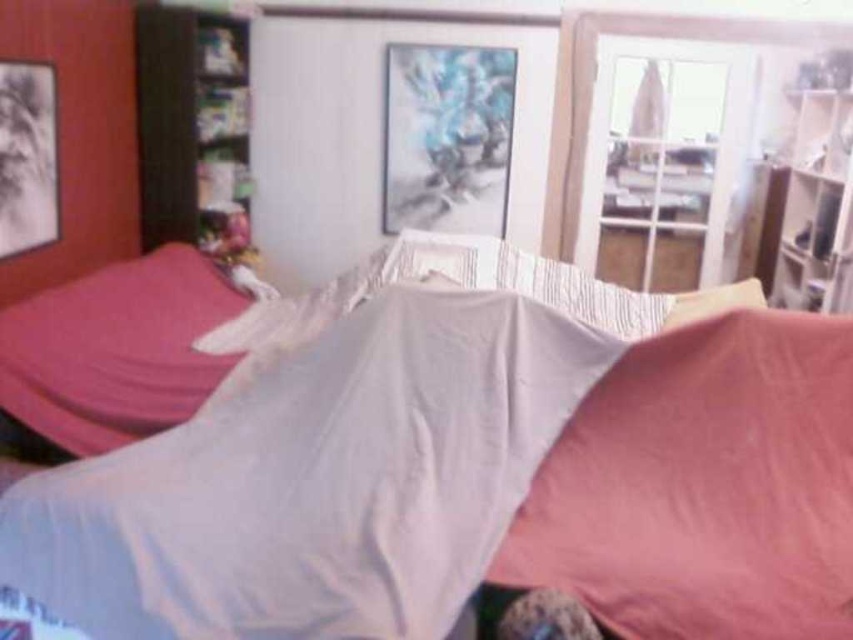
Question: Estimate the real-world distances between objects in this image. Which object is closer to the white fabric sheet at center?

Choices:
 (A) pink fabric pillow at lower right
 (B) pink fabric pillow at left

Answer: (A)

Question: Can you confirm if pink fabric pillow at lower right is positioned below pink fabric pillow at left?

Choices:
 (A) yes
 (B) no

Answer: (A)

Question: Is the position of white fabric sheet at center more distant than that of pink fabric pillow at left?

Choices:
 (A) no
 (B) yes

Answer: (A)

Question: Is pink fabric pillow at lower right to the left of pink fabric pillow at left from the viewer's perspective?

Choices:
 (A) no
 (B) yes

Answer: (A)

Question: Which of the following is the closest to the observer?

Choices:
 (A) pink fabric pillow at left
 (B) white fabric sheet at center
 (C) pink fabric pillow at lower right

Answer: (B)

Question: Which point appears closest to the camera in this image?

Choices:
 (A) (602, 532)
 (B) (172, 356)

Answer: (A)